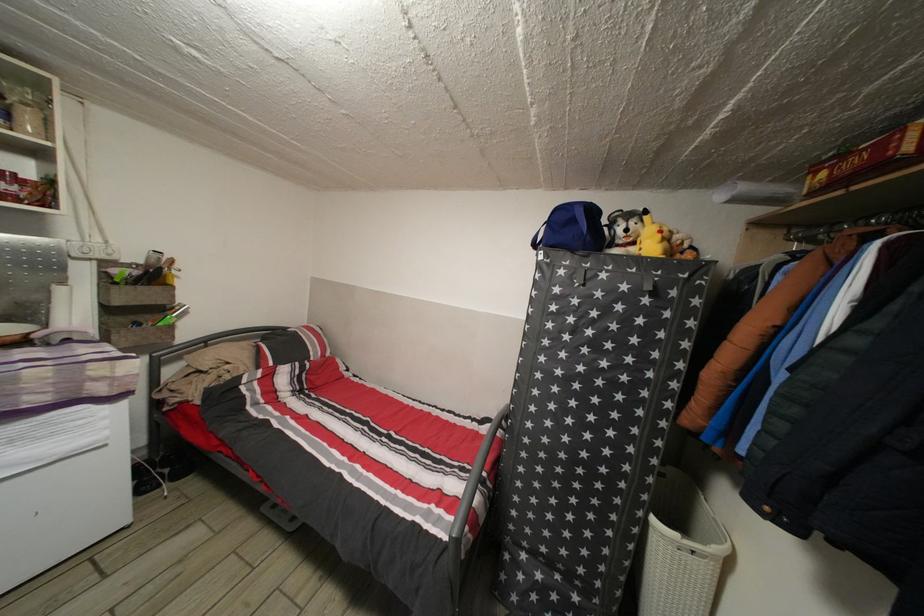
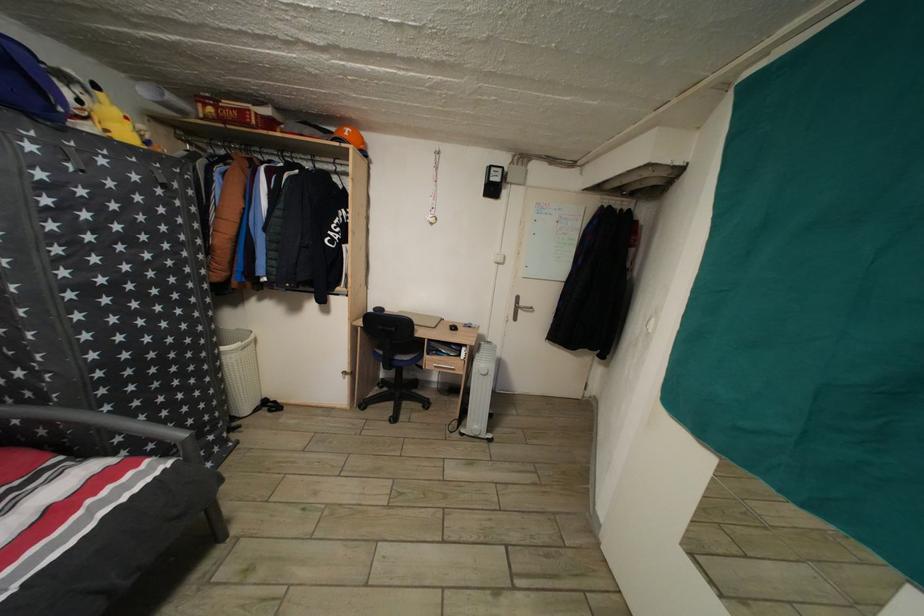
The point at (661,525) is marked in the first image. Where is the corresponding point in the second image?

(229, 355)